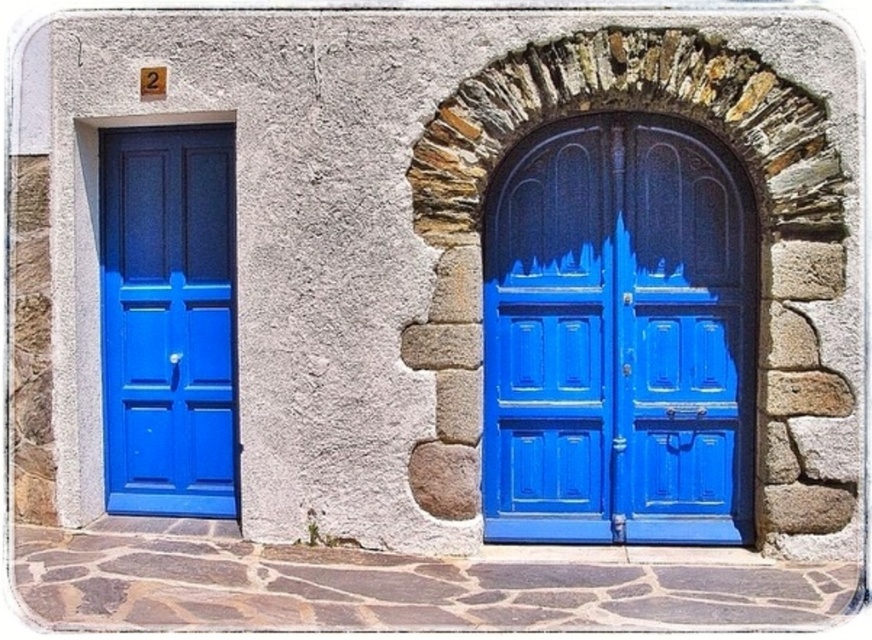
Does matte blue door at center have a lesser width compared to matte blue door at left?

No, matte blue door at center is not thinner than matte blue door at left.

Can you confirm if matte blue door at center is positioned to the right of matte blue door at left?

Yes, matte blue door at center is to the right of matte blue door at left.

Is point (717, 244) in front of point (223, 173)?

Yes.

Locate an element on the screen. matte blue door at center is located at coordinates click(x=618, y=337).